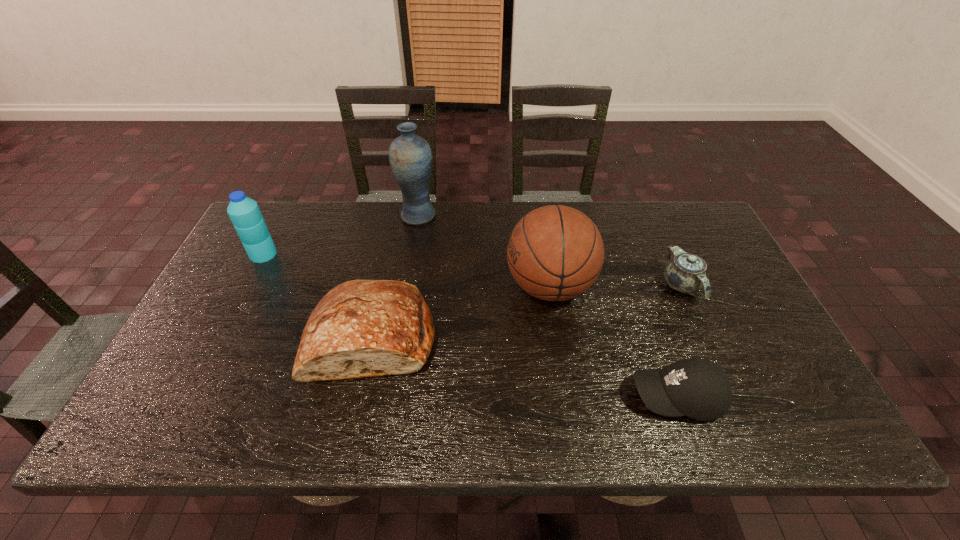
Where is `free spot between the fourth object from left to right and the third tallest object`? The height and width of the screenshot is (540, 960). free spot between the fourth object from left to right and the third tallest object is located at coordinates (406, 271).

The width and height of the screenshot is (960, 540). What are the coordinates of `empty location between the leftmost object and the chinaware` in the screenshot? It's located at (472, 270).

This screenshot has width=960, height=540. In order to click on free spot between the chinaware and the baseball cap in this screenshot , I will do `click(679, 341)`.

You are a GUI agent. You are given a task and a screenshot of the screen. Output one action in this format:
    pyautogui.click(x=<x>, y=<y>)
    Task: Click on the free space between the baseball cap and the basketball
    The image size is (960, 540).
    Given the screenshot: What is the action you would take?
    pyautogui.click(x=612, y=342)

In order to click on free space that is in between the chinaware and the leftmost object in this screenshot , I will do `click(472, 270)`.

You are a GUI agent. You are given a task and a screenshot of the screen. Output one action in this format:
    pyautogui.click(x=<x>, y=<y>)
    Task: Click on the vacant space that is in between the water bottle and the chinaware
    
    Given the screenshot: What is the action you would take?
    coord(472,270)

You are a GUI agent. You are given a task and a screenshot of the screen. Output one action in this format:
    pyautogui.click(x=<x>, y=<y>)
    Task: Click on the empty space that is in between the fourth tallest object and the fourth shortest object
    The height and width of the screenshot is (540, 960).
    Given the screenshot: What is the action you would take?
    pyautogui.click(x=318, y=296)

In order to click on the third closest object to the chinaware in this screenshot , I will do `click(361, 328)`.

Identify which object is the fifth nearest to the third object from right to left. Please provide its 2D coordinates. Your answer should be formatted as a tuple, i.e. [(x, y)], where the tuple contains the x and y coordinates of a point satisfying the conditions above.

[(244, 212)]

Identify the location of vacant space that satisfies the following two spatial constraints: 1. on the side with brand label of the fourth object from left to right; 2. at the sliced front of the bread. The image size is (960, 540). (558, 338).